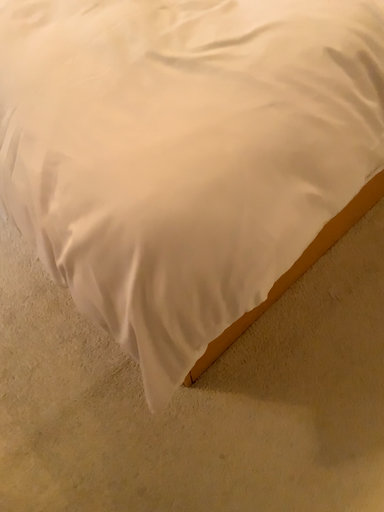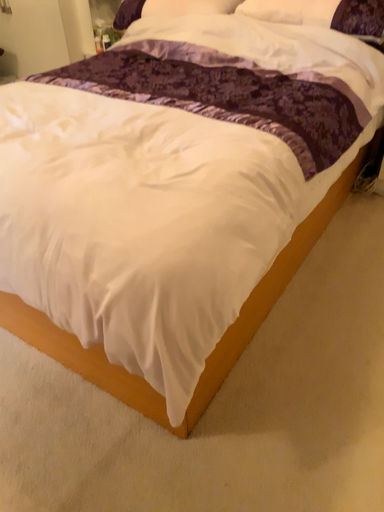
Question: Which way did the camera rotate in the video?

Choices:
 (A) rotated left
 (B) rotated right

Answer: (B)